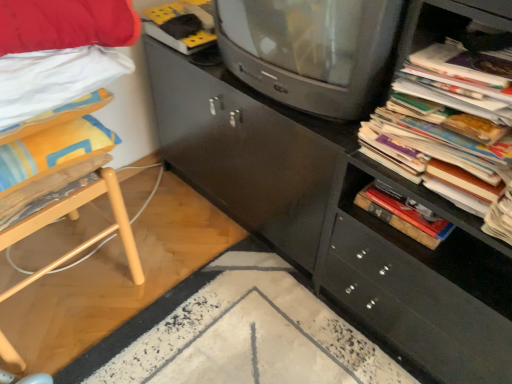
Question: Is matte gray television at center far from matte black cabinet at center?

Choices:
 (A) no
 (B) yes

Answer: (A)

Question: Does matte gray television at center have a smaller size compared to matte black cabinet at center?

Choices:
 (A) yes
 (B) no

Answer: (A)

Question: From the image's perspective, does matte gray television at center appear higher than matte black cabinet at center?

Choices:
 (A) yes
 (B) no

Answer: (A)

Question: Can you confirm if matte gray television at center is taller than matte black cabinet at center?

Choices:
 (A) yes
 (B) no

Answer: (B)

Question: Is matte gray television at center to the right of matte black cabinet at center from the viewer's perspective?

Choices:
 (A) no
 (B) yes

Answer: (A)

Question: Considering the positions of point (438, 210) and point (36, 213), is point (438, 210) closer or farther from the camera than point (36, 213)?

Choices:
 (A) farther
 (B) closer

Answer: (B)

Question: Would you say stacked paper at right is to the left or to the right of light wood chair at left in the picture?

Choices:
 (A) left
 (B) right

Answer: (B)

Question: Is stacked paper at right bigger or smaller than light wood chair at left?

Choices:
 (A) big
 (B) small

Answer: (B)

Question: Considering their positions, is stacked paper at right located in front of or behind light wood chair at left?

Choices:
 (A) front
 (B) behind

Answer: (A)

Question: Looking at their shapes, would you say light wood chair at left is wider or thinner than stacked paper at right?

Choices:
 (A) thin
 (B) wide

Answer: (B)

Question: Considering the positions of point (11, 294) and point (502, 21), is point (11, 294) closer or farther from the camera than point (502, 21)?

Choices:
 (A) closer
 (B) farther

Answer: (B)

Question: Relative to stacked paper at right, is light wood chair at left in front or behind?

Choices:
 (A) front
 (B) behind

Answer: (B)

Question: From the image's perspective, is light wood chair at left positioned above or below stacked paper at right?

Choices:
 (A) below
 (B) above

Answer: (A)

Question: In terms of height, does matte gray television at center look taller or shorter compared to light wood chair at left?

Choices:
 (A) tall
 (B) short

Answer: (B)

Question: Looking at their shapes, would you say matte gray television at center is wider or thinner than light wood chair at left?

Choices:
 (A) thin
 (B) wide

Answer: (A)